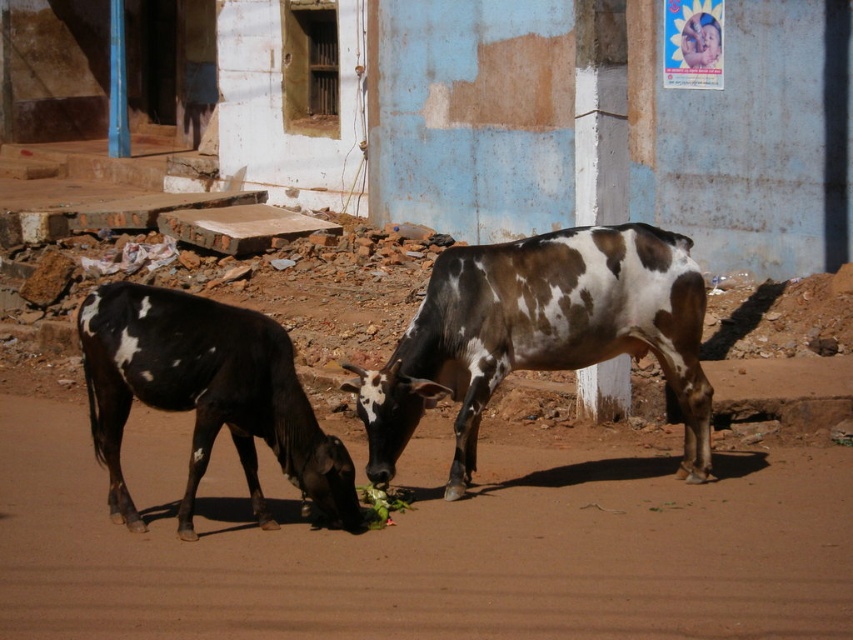
You are standing at the point with coordinates (425,544) in the image. What is the name of the object located exactly at this point?

The point at coordinates (425,544) indicates the brown dirt track at center.

You are standing at the origin point of the image. Where is the brown spotted cow at center located?

The brown spotted cow at center is located at point (538,333).

You are a farmer who wants to separate the cows. You have a fence that can only separate the brown spotted cow at center from the black and white spotted cow at left if they are not next to each other. Are they positioned in a way that allows this?

The brown spotted cow at center is to the right of the black and white spotted cow at left, so they are adjacent to each other. Therefore, the fence cannot separate them since they are next to each other.